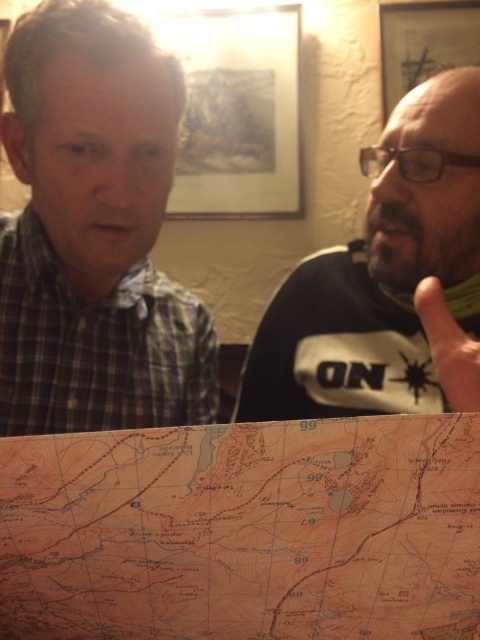
Is point (163, 556) farther from camera compared to point (81, 212)?

No, it is not.

Between orange paper map at lower center and green plaid shirt at upper left, which one is positioned higher?

green plaid shirt at upper left is above.

In order to click on orange paper map at lower center in this screenshot , I will do `click(243, 531)`.

Find the location of `orange paper map at lower center`. orange paper map at lower center is located at coordinates (243, 531).

Is orange paper map at lower center wider than bearded man at right?

Yes.

Which is behind, point (97, 509) or point (409, 333)?

Positioned behind is point (409, 333).

Find the location of a particular element. This screenshot has width=480, height=640. orange paper map at lower center is located at coordinates (243, 531).

Does green plaid shirt at upper left have a greater height compared to bearded man at right?

Yes.

Does point (104, 58) come behind point (436, 364)?

Yes, it is.

Is point (162, 385) positioned after point (396, 250)?

Yes, it is.

Where is `green plaid shirt at upper left`? The height and width of the screenshot is (640, 480). green plaid shirt at upper left is located at coordinates (95, 232).